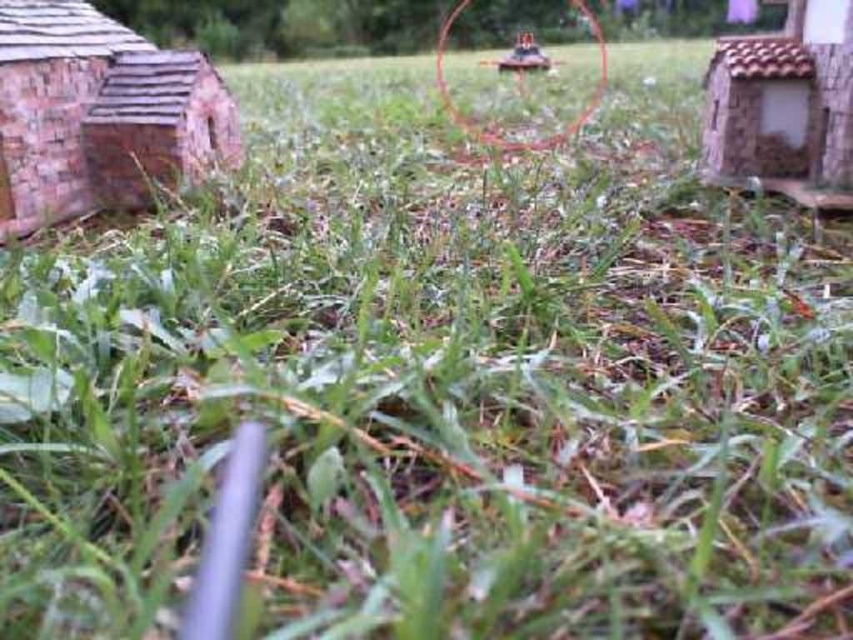
You are standing in the garden looking at the grassy area. There is a point marked at coordinates (785, 106). Which object does this point correspond to?

The point at coordinates (785, 106) corresponds to the rustic stone hut at right.